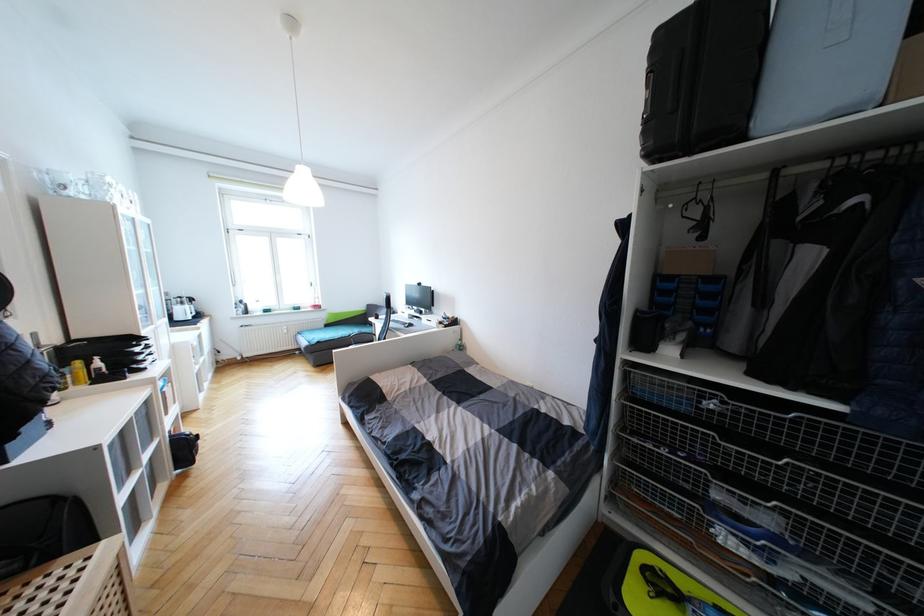
What are the coordinates of `yellow dispenser pump` in the screenshot? It's located at (80, 371).